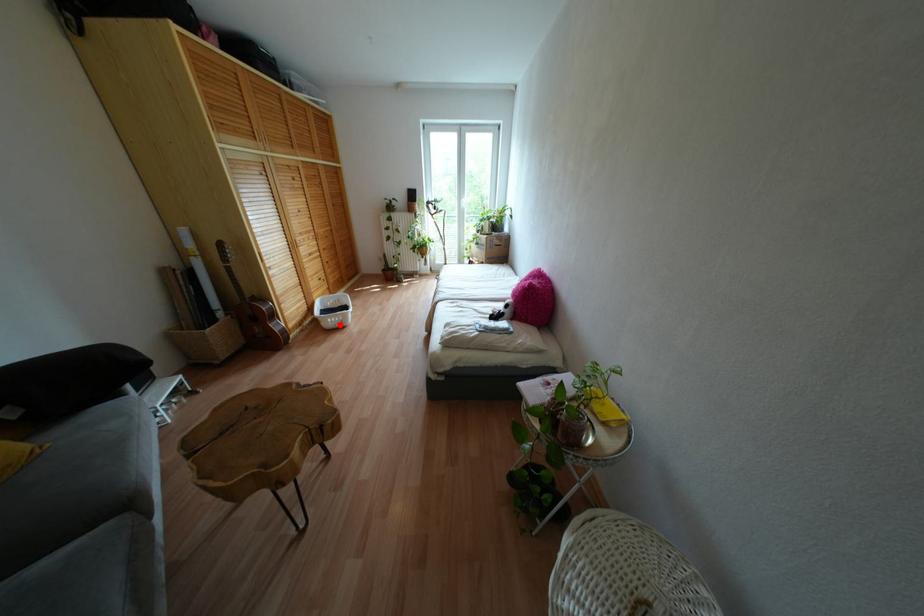
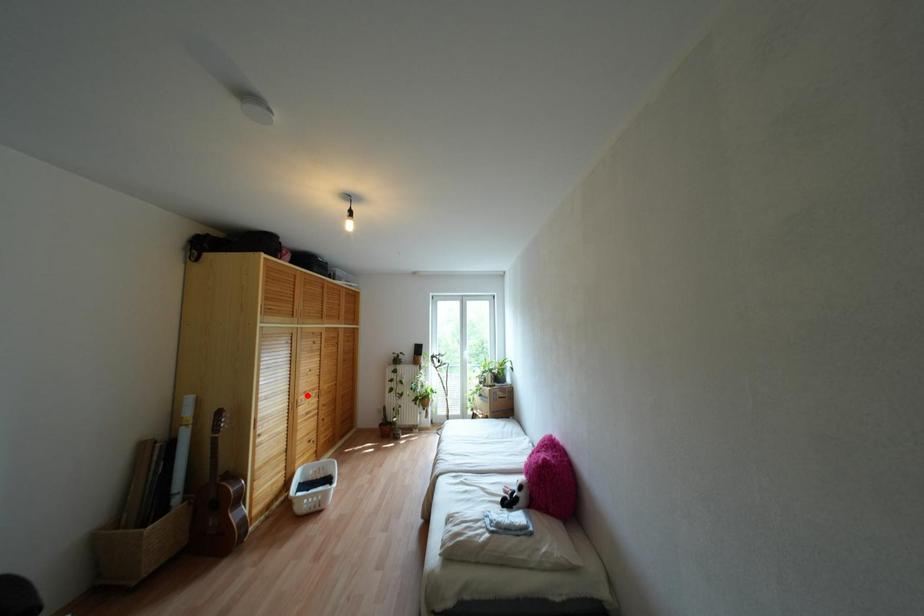
I am providing you with two images of the same scene from different viewpoints. A red point is marked on the first image and another point is marked on the second image. Are the points marked in image1 and image2 representing the same 3D position?

No